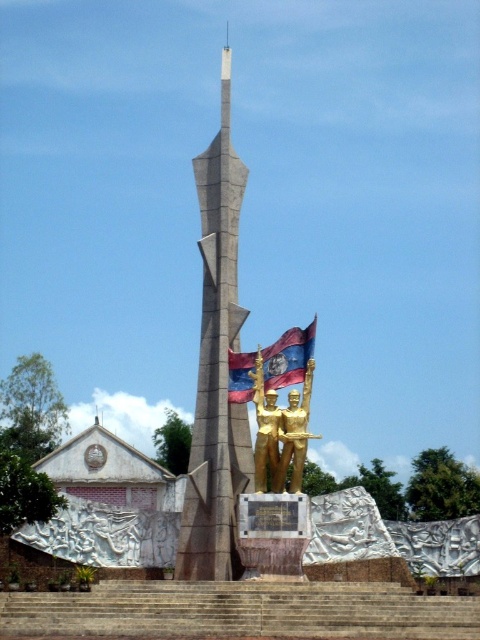
Question: Which point is closer to the camera?

Choices:
 (A) (301, 458)
 (B) (236, 394)

Answer: (A)

Question: Can you confirm if gray concrete tower at center is wider than red fabric flag at center?

Choices:
 (A) yes
 (B) no

Answer: (B)

Question: Among these objects, which one is nearest to the camera?

Choices:
 (A) gray concrete tower at center
 (B) brown stone stairs at center

Answer: (B)

Question: In this image, where is brown stone stairs at center located relative to gold metallic statue at center?

Choices:
 (A) below
 (B) above

Answer: (A)

Question: Is brown stone stairs at center further to camera compared to gold metallic statue at center?

Choices:
 (A) yes
 (B) no

Answer: (B)

Question: Which point appears closest to the camera in this image?

Choices:
 (A) (212, 182)
 (B) (319, 436)
 (C) (436, 612)
 (D) (267, 371)

Answer: (C)